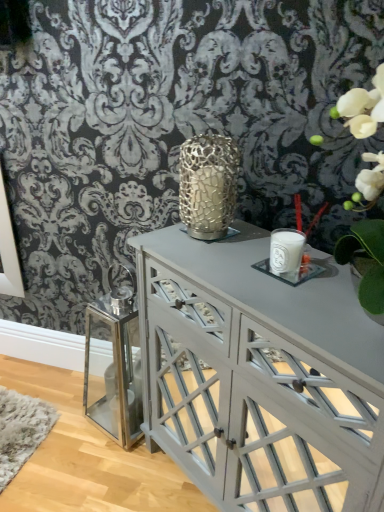
Locate an element on the screen. free space in front of gold textured candle holder at center, marked as the 1th candle holder in a top-to-bottom arrangement is located at coordinates (213, 259).